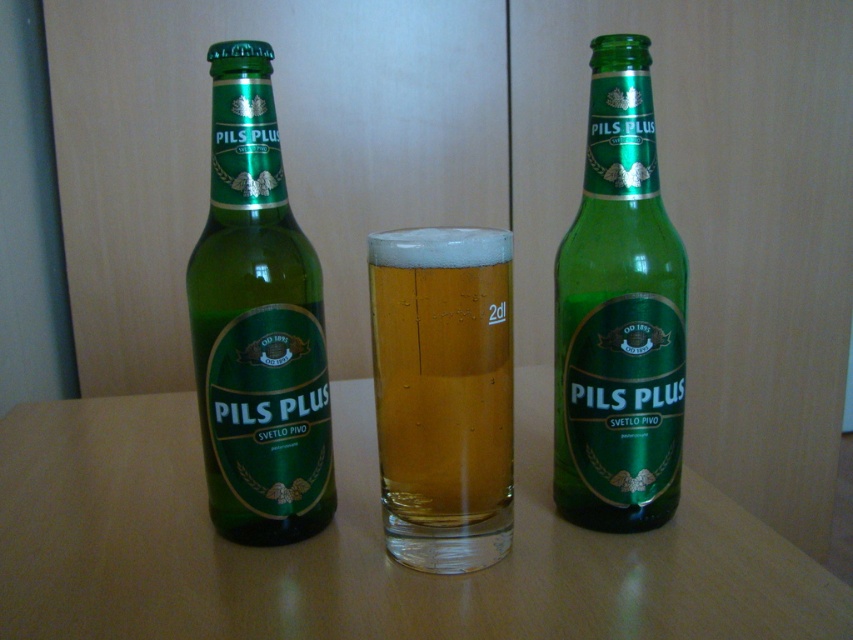
Question: Considering the real-world distances, which object is closest to the green glass bottle at center?

Choices:
 (A) green glass bottle at left
 (B) translucent glass at center
 (C) green glass table at center

Answer: (B)

Question: Among these points, which one is nearest to the camera?

Choices:
 (A) [393, 412]
 (B) [578, 435]

Answer: (A)

Question: Is green glass table at center to the left of green glass bottle at left from the viewer's perspective?

Choices:
 (A) yes
 (B) no

Answer: (B)

Question: Which object is farther from the camera taking this photo?

Choices:
 (A) green glass table at center
 (B) translucent glass at center
 (C) green glass bottle at left
 (D) green glass bottle at center

Answer: (D)

Question: Is green glass table at center further to camera compared to green glass bottle at left?

Choices:
 (A) no
 (B) yes

Answer: (A)

Question: Does green glass table at center appear on the left side of translucent glass at center?

Choices:
 (A) no
 (B) yes

Answer: (B)